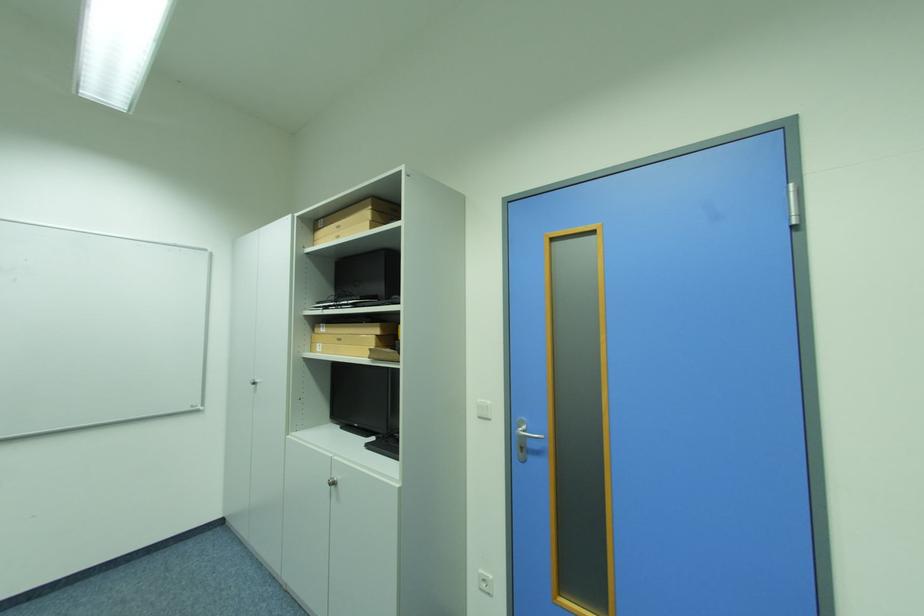
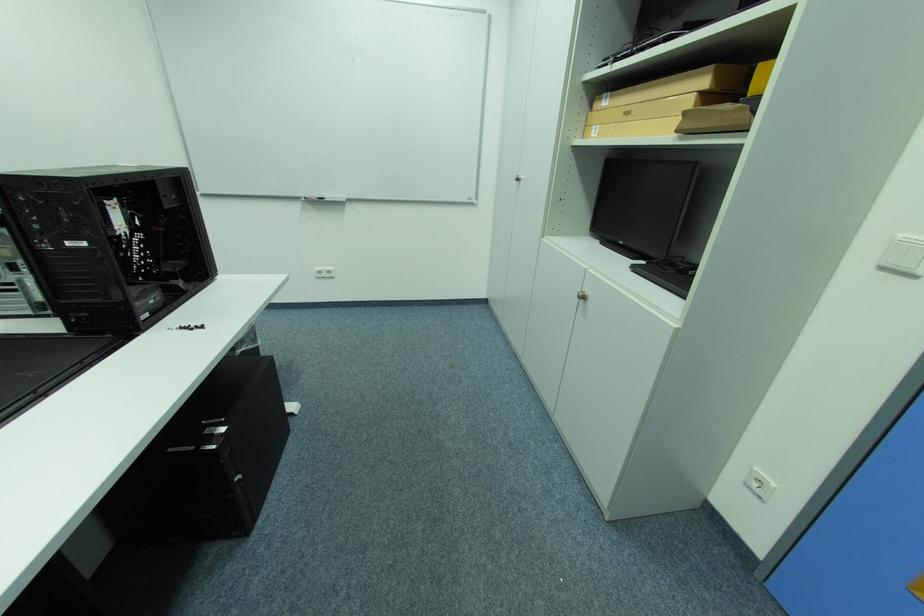
In the second image, find the point that corresponds to point (325, 345) in the first image.

(602, 128)